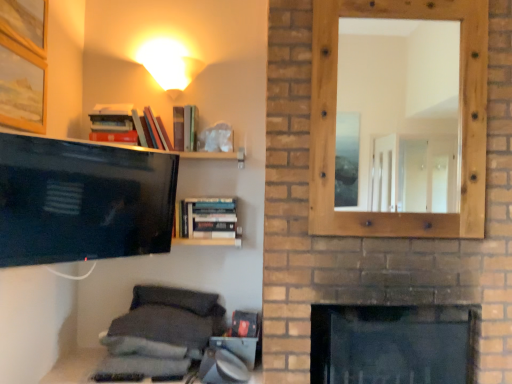
Question: Does wooden picture frame at upper left, arranged as the second picture frame when ordered from the bottom, have a larger size compared to dark gray fabric pillow at lower center, arranged as the first pillow when viewed from the top?

Choices:
 (A) yes
 (B) no

Answer: (B)

Question: Can you confirm if wooden picture frame at upper left, the first picture frame when ordered from top to bottom, is positioned to the right of dark gray fabric pillow at lower center, marked as the third pillow in a bottom-to-top arrangement?

Choices:
 (A) yes
 (B) no

Answer: (B)

Question: From the image's perspective, is wooden picture frame at upper left, arranged as the second picture frame when ordered from the bottom, on dark gray fabric pillow at lower center, marked as the third pillow in a bottom-to-top arrangement?

Choices:
 (A) yes
 (B) no

Answer: (A)

Question: Is wooden picture frame at upper left, arranged as the second picture frame when ordered from the bottom, next to dark gray fabric pillow at lower center, arranged as the first pillow when viewed from the top?

Choices:
 (A) no
 (B) yes

Answer: (A)

Question: Considering the relative sizes of wooden picture frame at upper left, the first picture frame when ordered from top to bottom, and dark gray fabric pillow at lower center, marked as the third pillow in a bottom-to-top arrangement, in the image provided, is wooden picture frame at upper left, the first picture frame when ordered from top to bottom, thinner than dark gray fabric pillow at lower center, marked as the third pillow in a bottom-to-top arrangement,?

Choices:
 (A) no
 (B) yes

Answer: (B)

Question: Is wooden picture frame at upper left, the first picture frame when ordered from top to bottom, far away from dark gray fabric pillow at lower center, marked as the third pillow in a bottom-to-top arrangement?

Choices:
 (A) yes
 (B) no

Answer: (A)

Question: Is wooden picture frame at upper left, arranged as the second picture frame when ordered from the bottom, not near gray fabric pillow at lower center, which ranks as the 1th pillow in bottom-to-top order?

Choices:
 (A) yes
 (B) no

Answer: (A)

Question: Is gray fabric pillow at lower center, which ranks as the 1th pillow in bottom-to-top order, located within wooden picture frame at upper left, the first picture frame when ordered from top to bottom?

Choices:
 (A) yes
 (B) no

Answer: (B)

Question: From the image's perspective, is wooden picture frame at upper left, arranged as the second picture frame when ordered from the bottom, located above gray fabric pillow at lower center, which ranks as the 1th pillow in bottom-to-top order?

Choices:
 (A) yes
 (B) no

Answer: (A)

Question: From a real-world perspective, does wooden picture frame at upper left, arranged as the second picture frame when ordered from the bottom, stand above gray fabric pillow at lower center, which ranks as the 1th pillow in bottom-to-top order?

Choices:
 (A) no
 (B) yes

Answer: (B)

Question: Is wooden picture frame at upper left, the first picture frame when ordered from top to bottom, in front of gray fabric pillow at lower center, which appears as the third pillow when viewed from the top?

Choices:
 (A) yes
 (B) no

Answer: (A)

Question: Does wooden picture frame at upper left, arranged as the second picture frame when ordered from the bottom, turn towards gray fabric pillow at lower center, which ranks as the 1th pillow in bottom-to-top order?

Choices:
 (A) yes
 (B) no

Answer: (B)

Question: Is gray fabric pillow at lower center, the 2th pillow from the top, a part of matte white cone at upper center?

Choices:
 (A) yes
 (B) no

Answer: (B)